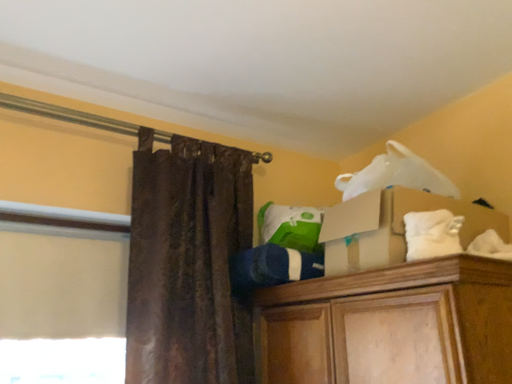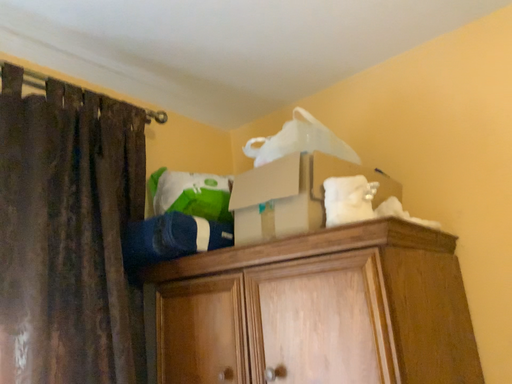
Question: Which way did the camera rotate in the video?

Choices:
 (A) rotated left
 (B) rotated right

Answer: (B)